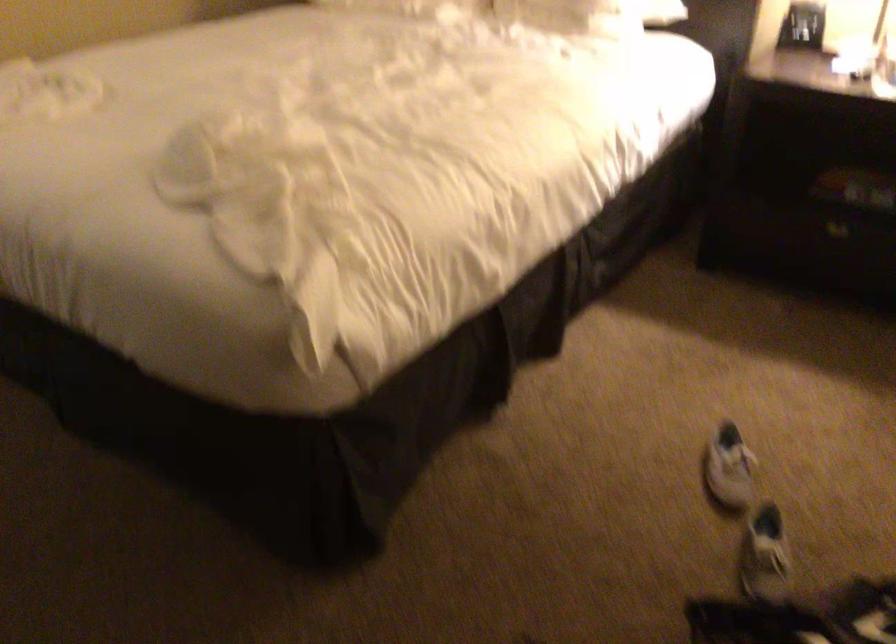
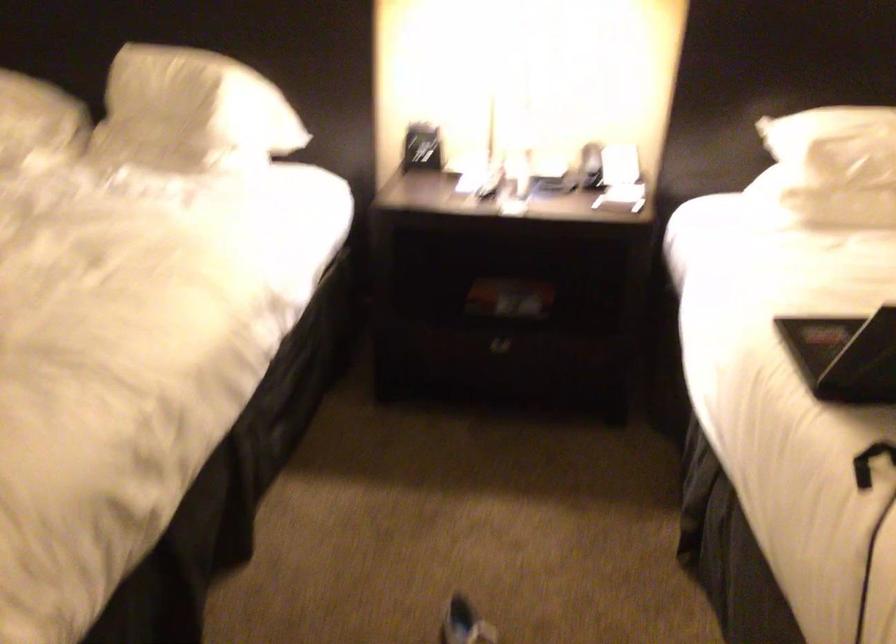
Question: The camera is either moving clockwise (left) or counter-clockwise (right) around the object. The first image is from the beginning of the video and the second image is from the end. Is the camera moving left or right when shooting the video?

Choices:
 (A) Left
 (B) Right

Answer: (A)